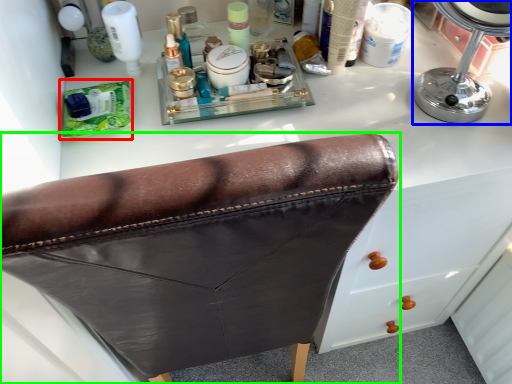
Question: Which object is positioned closest to product (highlighted by a red box)? Select from mirror (highlighted by a blue box) and furniture (highlighted by a green box).

Choices:
 (A) mirror
 (B) furniture

Answer: (B)